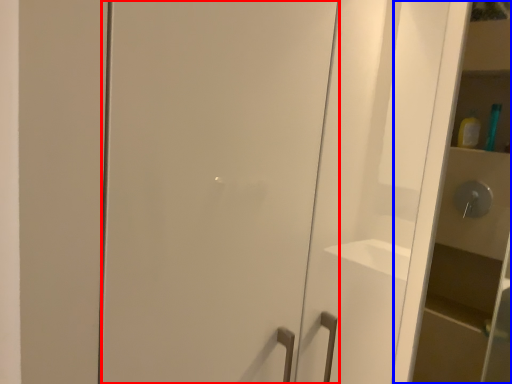
Question: Which object is further to the camera taking this photo, door (highlighted by a red box) or cabinetry (highlighted by a blue box)?

Choices:
 (A) door
 (B) cabinetry

Answer: (B)